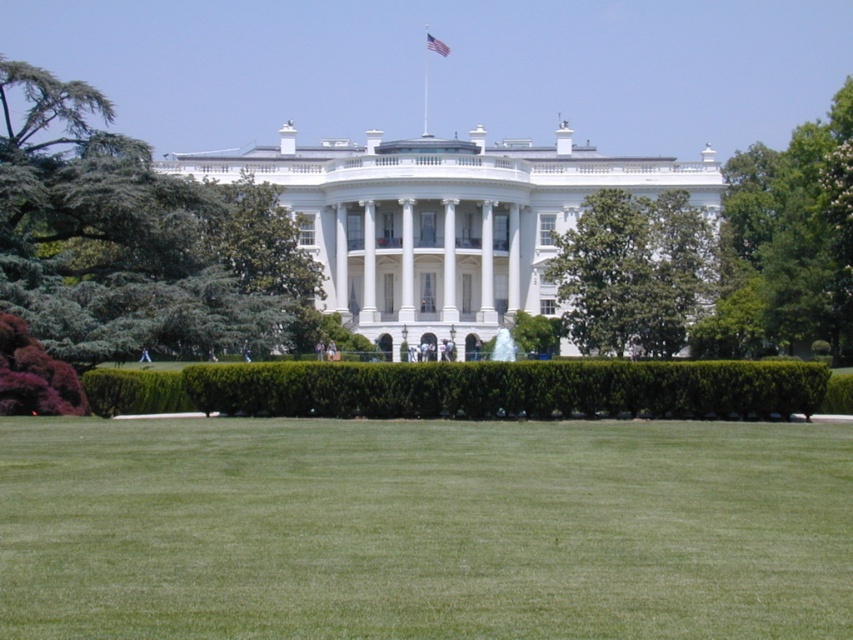
Question: Which object appears closest to the camera in this image?

Choices:
 (A) green leafy hedge at center
 (B) american flag at upper center

Answer: (A)

Question: Can you confirm if green leafy hedge at center is positioned to the right of green leafy tree at upper right?

Choices:
 (A) yes
 (B) no

Answer: (B)

Question: Is green leafy tree at left to the left of green leafy tree at upper right from the viewer's perspective?

Choices:
 (A) no
 (B) yes

Answer: (B)

Question: Which of these objects is positioned farthest from the green leafy tree at left?

Choices:
 (A) green leafy hedge at center
 (B) green smooth grass at lower center

Answer: (B)

Question: Does green leafy tree at upper right have a greater width compared to metallic flag pole at upper center?

Choices:
 (A) yes
 (B) no

Answer: (A)

Question: Estimate the real-world distances between objects in this image. Which object is farther from the american flag at upper center?

Choices:
 (A) green leafy tree at center
 (B) green smooth grass at lower center
 (C) green leafy tree at upper right
 (D) green leafy hedge at center

Answer: (B)